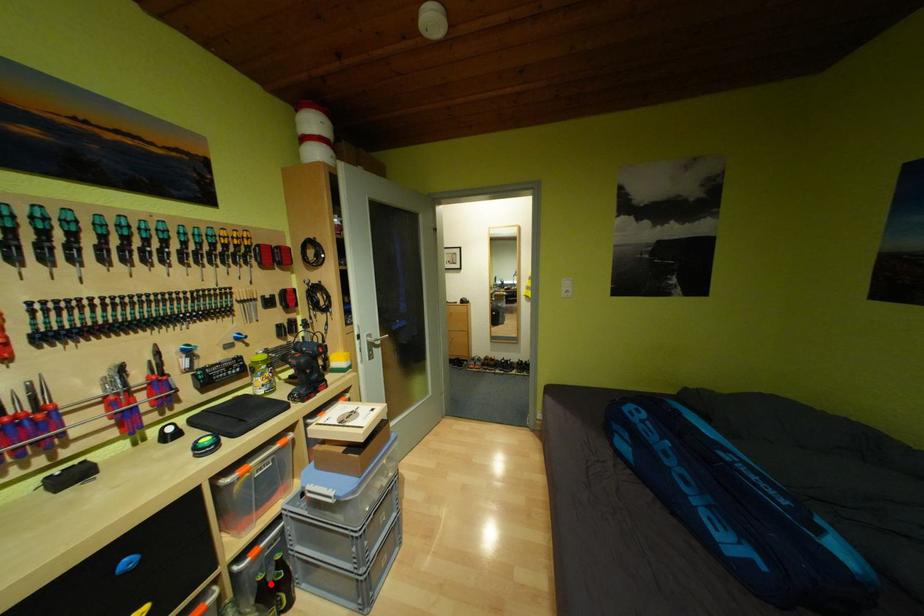
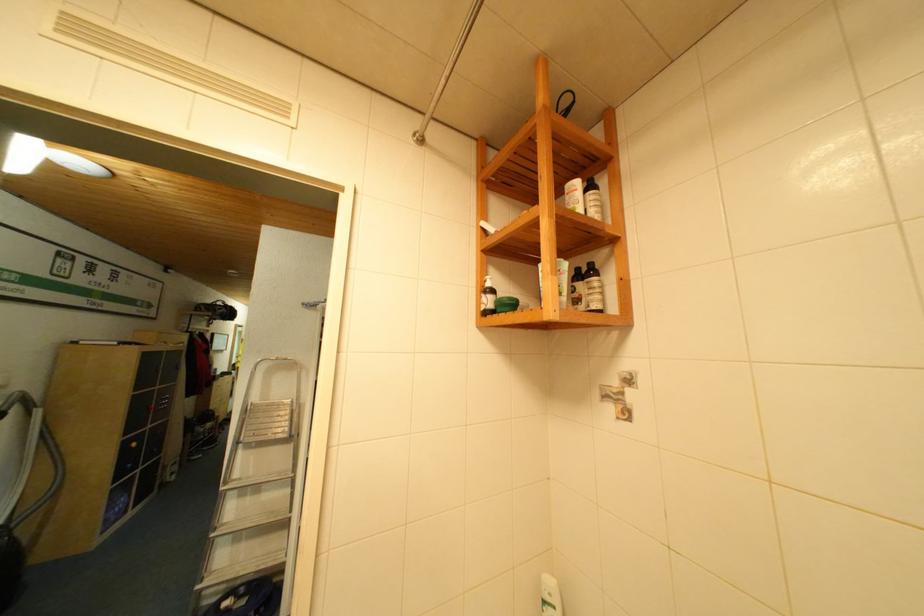
Question: I am providing you with two images of the same scene from different viewpoints. A red point is marked on the first image. Is the red point's position out of view in image 2?

Choices:
 (A) Yes
 (B) No

Answer: (A)